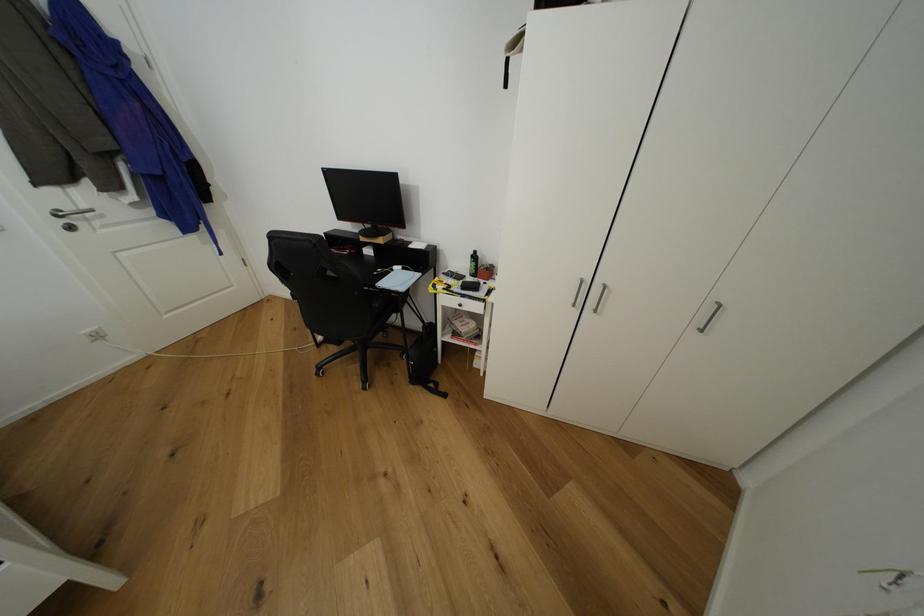
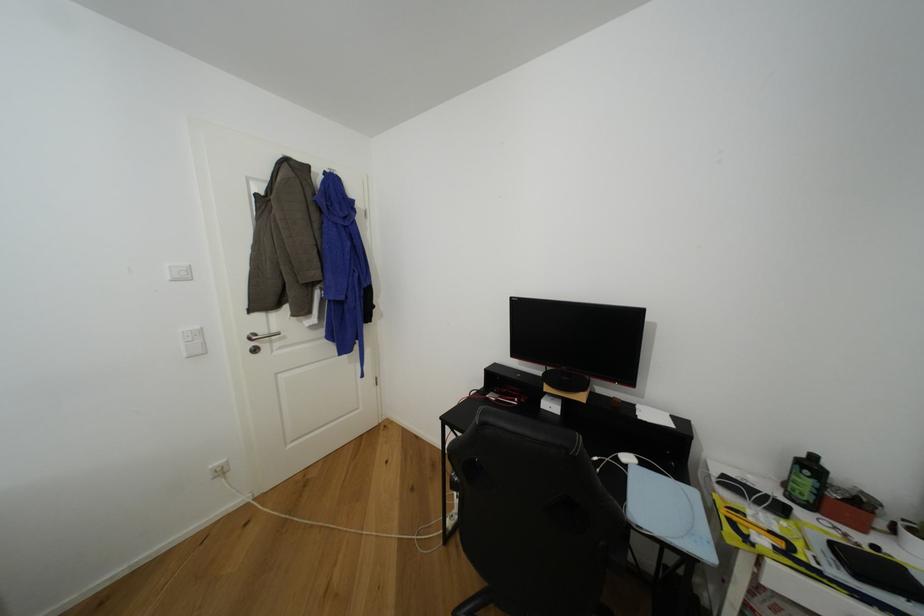
The images are taken continuously from a first-person perspective. In which direction are you moving?

The cameraman moved toward left, forward.